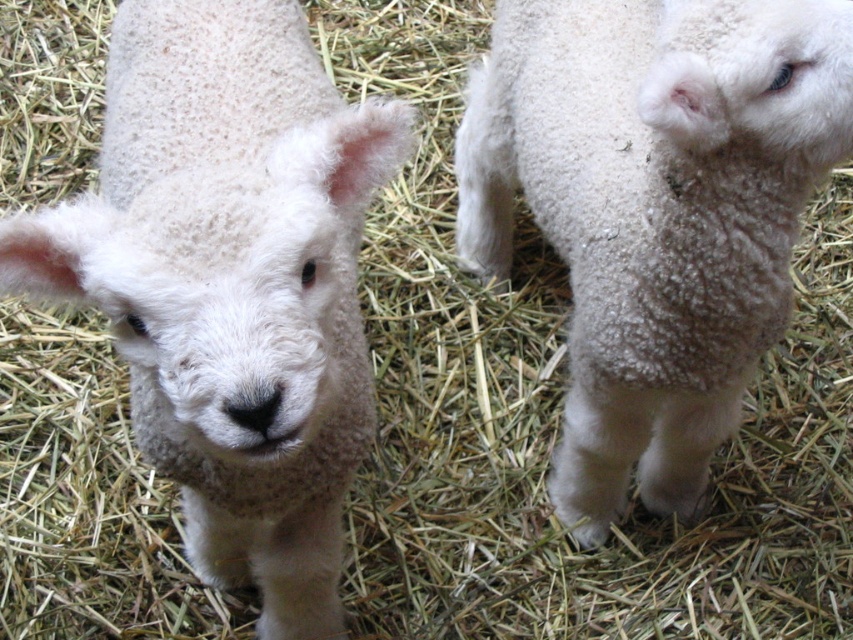
Measure the distance from white woolen lamb at center to white fluffy lamb at center.

white woolen lamb at center is 17.27 inches from white fluffy lamb at center.

Between point (300, 452) and point (804, 68), which one is positioned behind?

The point (300, 452) is behind.

Is point (311, 572) positioned after point (666, 36)?

Yes, it is.

Find the location of a particular element. This screenshot has height=640, width=853. white woolen lamb at center is located at coordinates (231, 282).